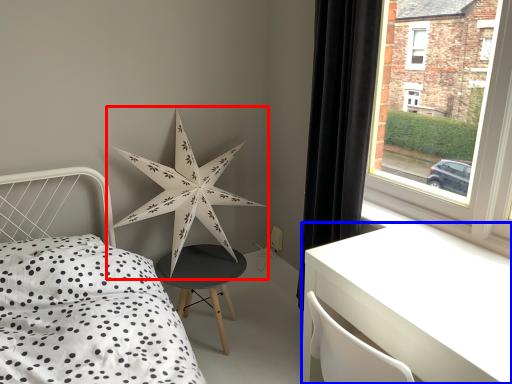
Question: Which of the following is the farthest to the observer, star (highlighted by a red box) or table (highlighted by a blue box)?

Choices:
 (A) star
 (B) table

Answer: (A)